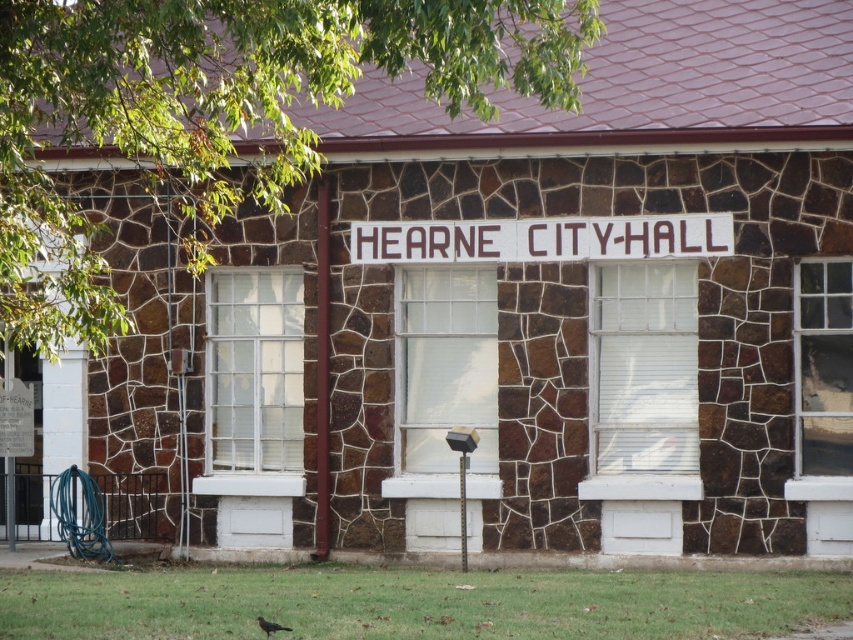
Question: Estimate the real-world distances between objects in this image. Which object is closer to the clear glass window at center?

Choices:
 (A) white painted wood sign at center
 (B) white textured window at center
 (C) clear glass window at right

Answer: (A)

Question: Is the position of white textured window at center less distant than that of clear glass window at right?

Choices:
 (A) no
 (B) yes

Answer: (A)

Question: Where is white painted wood sign at center located in relation to clear glass window at right in the image?

Choices:
 (A) left
 (B) right

Answer: (A)

Question: Which point is farther from the camera taking this photo?

Choices:
 (A) (675, 493)
 (B) (840, 426)

Answer: (A)

Question: Does white glass window at center appear under clear glass window at right?

Choices:
 (A) no
 (B) yes

Answer: (B)

Question: Estimate the real-world distances between objects in this image. Which object is closer to the white painted wood sign at center?

Choices:
 (A) clear glass window at center
 (B) white glass window at center
 (C) white textured window at center
 (D) clear glass window at right

Answer: (A)